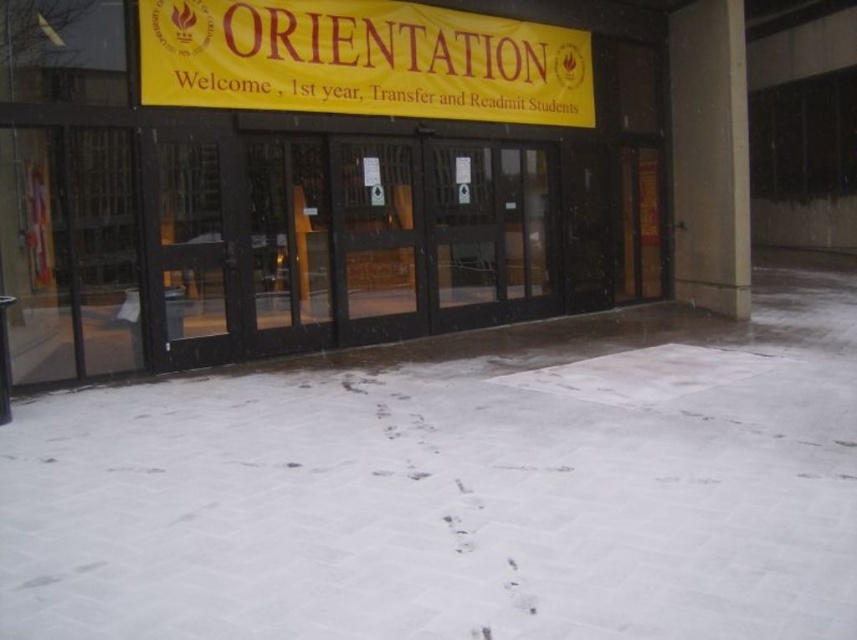
Question: Among these objects, which one is nearest to the camera?

Choices:
 (A) yellow/yellowish paper at upper center
 (B) black glass doors at center
 (C) white powdery snow at center

Answer: (C)

Question: Which point appears closest to the camera in this image?

Choices:
 (A) (762, 444)
 (B) (138, 58)
 (C) (438, 52)

Answer: (A)

Question: Is white powdery snow at center positioned behind black glass doors at center?

Choices:
 (A) yes
 (B) no

Answer: (B)

Question: Is black glass doors at center further to camera compared to yellow/yellowish paper at upper center?

Choices:
 (A) yes
 (B) no

Answer: (B)

Question: Which object is positioned closest to the yellow/yellowish paper at upper center?

Choices:
 (A) black glass doors at center
 (B) white powdery snow at center

Answer: (A)

Question: Is white powdery snow at center positioned at the back of black glass doors at center?

Choices:
 (A) no
 (B) yes

Answer: (A)